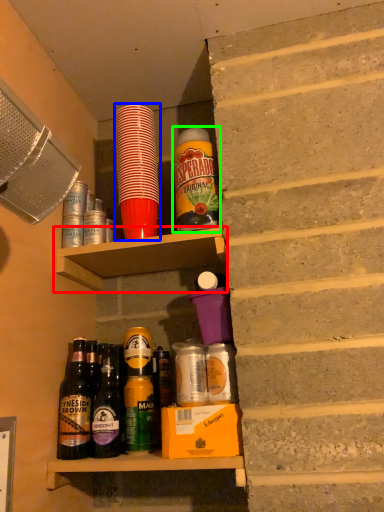
Question: Which object is the closest to the shelf (highlighted by a red box)? Choose among these: bottle (highlighted by a blue box) or bottle (highlighted by a green box).

Choices:
 (A) bottle
 (B) bottle

Answer: (A)